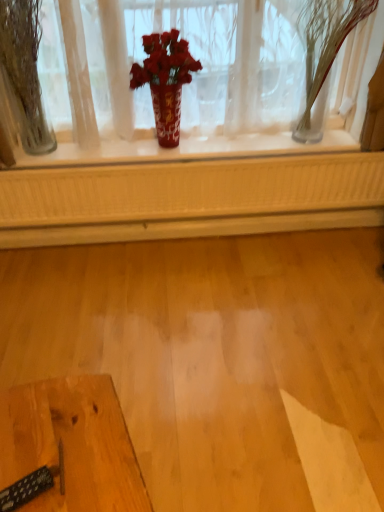
The height and width of the screenshot is (512, 384). Find the location of `wooden table at lower left`. wooden table at lower left is located at coordinates (72, 444).

The width and height of the screenshot is (384, 512). I want to click on red glossy vase at center, so click(x=186, y=78).

Find the location of `wooden table at lower left`. wooden table at lower left is located at coordinates (72, 444).

From a real-world perspective, does wooden table at lower left stand above clear glass vase at left, which ranks as the second tree in right-to-left order?

No, from a real-world perspective, wooden table at lower left is not over clear glass vase at left, which ranks as the second tree in right-to-left order

Can you confirm if wooden table at lower left is wider than clear glass vase at left, which is the 1th tree from left to right?

Yes, wooden table at lower left is wider than clear glass vase at left, which is the 1th tree from left to right.

From the image's perspective, is wooden table at lower left above clear glass vase at left, which ranks as the second tree in right-to-left order?

Incorrect, from the image's perspective, wooden table at lower left is lower than clear glass vase at left, which ranks as the second tree in right-to-left order.

Considering the relative sizes of wooden table at lower left and clear glass vase at left, which is the 1th tree from left to right, in the image provided, is wooden table at lower left taller than clear glass vase at left, which is the 1th tree from left to right,?

Incorrect, the height of wooden table at lower left is not larger of that of clear glass vase at left, which is the 1th tree from left to right.

Is clear glass vase at upper right, acting as the 2th tree starting from the left, outside of clear glass vase at left, which ranks as the second tree in right-to-left order?

That's correct, clear glass vase at upper right, acting as the 2th tree starting from the left, is outside of clear glass vase at left, which ranks as the second tree in right-to-left order.

Which object is closer to the camera taking this photo, clear glass vase at upper right, acting as the 2th tree starting from the left, or clear glass vase at left, which ranks as the second tree in right-to-left order?

clear glass vase at upper right, acting as the 2th tree starting from the left, is in front.

Considering the sizes of objects clear glass vase at upper right, which is the 1th tree in right-to-left order, and clear glass vase at left, which ranks as the second tree in right-to-left order, in the image provided, who is bigger, clear glass vase at upper right, which is the 1th tree in right-to-left order, or clear glass vase at left, which ranks as the second tree in right-to-left order,?

clear glass vase at upper right, which is the 1th tree in right-to-left order.

There is a red glossy vase at center. Identify the location of the 1st tree below it (from the image's perspective). pos(325,49).

Is red glossy vase at center smaller than clear glass vase at upper right, which is the 1th tree in right-to-left order?

No, red glossy vase at center is not smaller than clear glass vase at upper right, which is the 1th tree in right-to-left order.

Could wooden table at lower left be considered to be inside red glossy vase at center?

No, red glossy vase at center does not contain wooden table at lower left.

Can you tell me how much red glossy vase at center and wooden table at lower left differ in facing direction?

There is a 71.9-degree angle between the facing directions of red glossy vase at center and wooden table at lower left.

Based on their sizes in the image, would you say red glossy vase at center is bigger or smaller than wooden table at lower left?

Clearly, red glossy vase at center is larger in size than wooden table at lower left.

Is clear glass vase at left, which ranks as the second tree in right-to-left order, wider or thinner than red glossy vase at center?

Clearly, clear glass vase at left, which ranks as the second tree in right-to-left order, has more width compared to red glossy vase at center.

Is point (8, 26) closer or farther from the camera than point (218, 153)?

Point (8, 26).

Which object is further away from the camera taking this photo, clear glass vase at left, which ranks as the second tree in right-to-left order, or red glossy vase at center?

red glossy vase at center is more distant.

Which of these two, clear glass vase at left, which ranks as the second tree in right-to-left order, or red glossy vase at center, is bigger?

red glossy vase at center.

Is clear glass vase at left, which ranks as the second tree in right-to-left order, in contact with wooden table at lower left?

No, clear glass vase at left, which ranks as the second tree in right-to-left order, is not in contact with wooden table at lower left.

Can you confirm if clear glass vase at left, which ranks as the second tree in right-to-left order, is thinner than wooden table at lower left?

Yes, clear glass vase at left, which ranks as the second tree in right-to-left order, is thinner than wooden table at lower left.

Which object is closer to the camera taking this photo, clear glass vase at left, which ranks as the second tree in right-to-left order, or wooden table at lower left?

wooden table at lower left is closer to the camera.

From the image's perspective, relative to wooden table at lower left, is clear glass vase at left, which is the 1th tree from left to right, above or below?

clear glass vase at left, which is the 1th tree from left to right, is situated higher than wooden table at lower left in the image.

In terms of width, does red glossy vase at center look wider or thinner when compared to clear glass vase at left, which is the 1th tree from left to right?

Considering their sizes, red glossy vase at center looks slimmer than clear glass vase at left, which is the 1th tree from left to right.

Looking at this image, is clear glass vase at left, which ranks as the second tree in right-to-left order, at the back of red glossy vase at center?

That's right, red glossy vase at center is facing away from clear glass vase at left, which ranks as the second tree in right-to-left order.

Is red glossy vase at center to the left of clear glass vase at left, which is the 1th tree from left to right, from the viewer's perspective?

Incorrect, red glossy vase at center is not on the left side of clear glass vase at left, which is the 1th tree from left to right.

From a real-world perspective, is red glossy vase at center located higher than clear glass vase at left, which ranks as the second tree in right-to-left order?

Actually, red glossy vase at center is physically below clear glass vase at left, which ranks as the second tree in right-to-left order, in the real world.

Locate an element on the screen. The width and height of the screenshot is (384, 512). tree that appears on the left of wooden table at lower left is located at coordinates (23, 75).

Identify the location of tree on the right of the clear glass vase at left, which is the 1th tree from left to right. The width and height of the screenshot is (384, 512). pyautogui.click(x=325, y=49).

Looking at the image, which one is located closer to clear glass vase at left, which ranks as the second tree in right-to-left order, red glossy vase at center or clear glass vase at upper right, which is the 1th tree in right-to-left order?

red glossy vase at center.

In the scene shown: Looking at the image, which one is located closer to clear glass vase at left, which is the 1th tree from left to right, clear glass vase at upper right, acting as the 2th tree starting from the left, or wooden table at lower left?

The object closer to clear glass vase at left, which is the 1th tree from left to right, is clear glass vase at upper right, acting as the 2th tree starting from the left.

Which object lies further to the anchor point clear glass vase at upper right, acting as the 2th tree starting from the left, clear glass vase at left, which ranks as the second tree in right-to-left order, or wooden table at lower left?

wooden table at lower left.

Which object lies further to the anchor point red glossy vase at center, wooden table at lower left or clear glass vase at upper right, acting as the 2th tree starting from the left?

Among the two, wooden table at lower left is located further to red glossy vase at center.

From the image, which object appears to be farther from wooden table at lower left, clear glass vase at upper right, acting as the 2th tree starting from the left, or red glossy vase at center?

clear glass vase at upper right, acting as the 2th tree starting from the left, is further to wooden table at lower left.

Considering their positions, is red glossy vase at center positioned further to wooden table at lower left than clear glass vase at upper right, which is the 1th tree in right-to-left order?

clear glass vase at upper right, which is the 1th tree in right-to-left order, lies further to wooden table at lower left than the other object.

From the image, which object appears to be farther from wooden table at lower left, red glossy vase at center or clear glass vase at left, which ranks as the second tree in right-to-left order?

The object further to wooden table at lower left is red glossy vase at center.

From the image, which object appears to be farther from clear glass vase at upper right, acting as the 2th tree starting from the left, wooden table at lower left or red glossy vase at center?

Among the two, wooden table at lower left is located further to clear glass vase at upper right, acting as the 2th tree starting from the left.

Locate an element on the screen. This screenshot has width=384, height=512. tree between clear glass vase at upper right, acting as the 2th tree starting from the left, and wooden table at lower left from top to bottom is located at coordinates (23, 75).

The height and width of the screenshot is (512, 384). Identify the location of window situated between clear glass vase at left, which is the 1th tree from left to right, and clear glass vase at upper right, acting as the 2th tree starting from the left, from left to right. (186, 78).